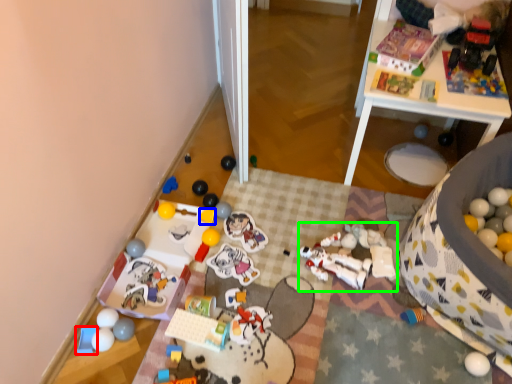
Question: Which object is positioned closest to toy (highlighted by a red box)? Select from toy (highlighted by a blue box) and toy (highlighted by a green box).

Choices:
 (A) toy
 (B) toy

Answer: (A)